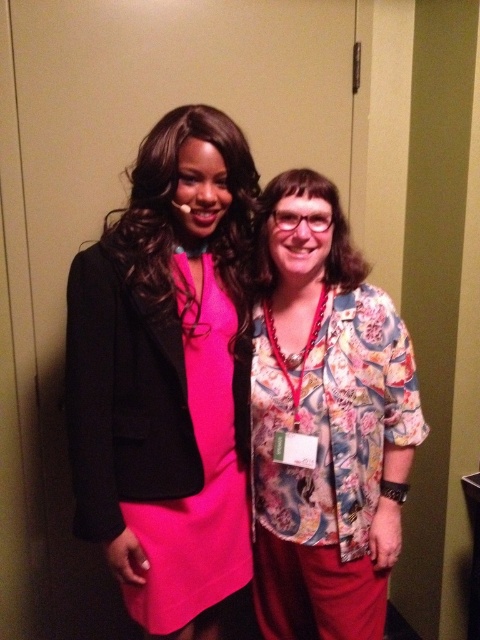
You are a photographer setting up a shoot in a hallway. You notice two people wearing the same style of matte pink dress at center and matte pink fabric dress at center. Which one is taller?

The matte pink dress at center is taller than the matte pink fabric dress at center.